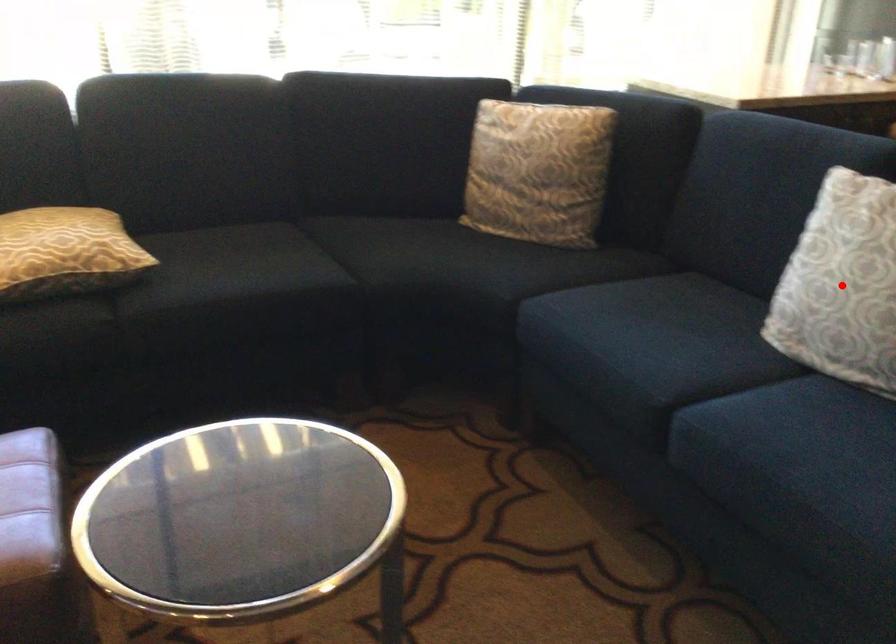
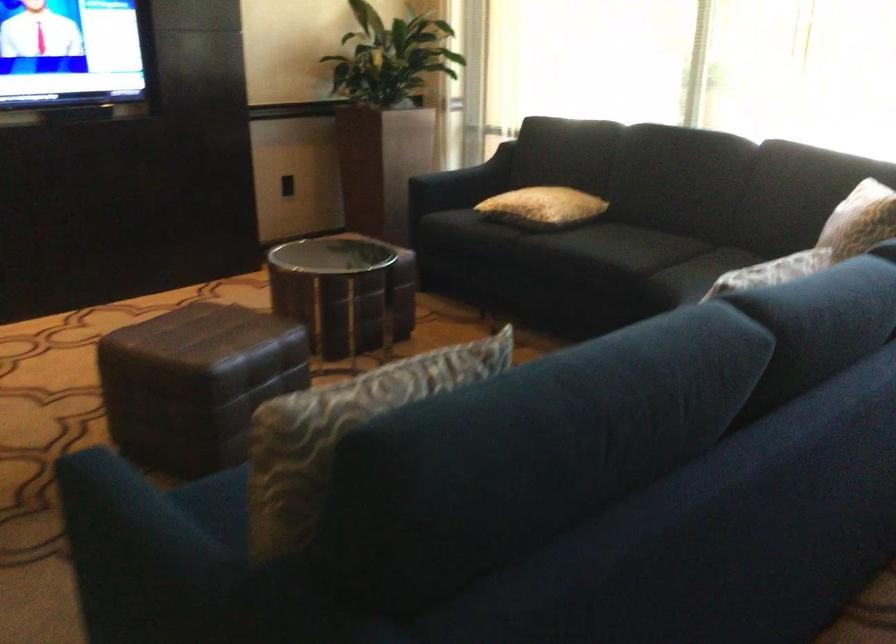
Question: I am providing you with two images of the same scene from different viewpoints. A red point is marked on the first image. Can you still see the location of the red point in image 2?

Choices:
 (A) Yes
 (B) No

Answer: (B)